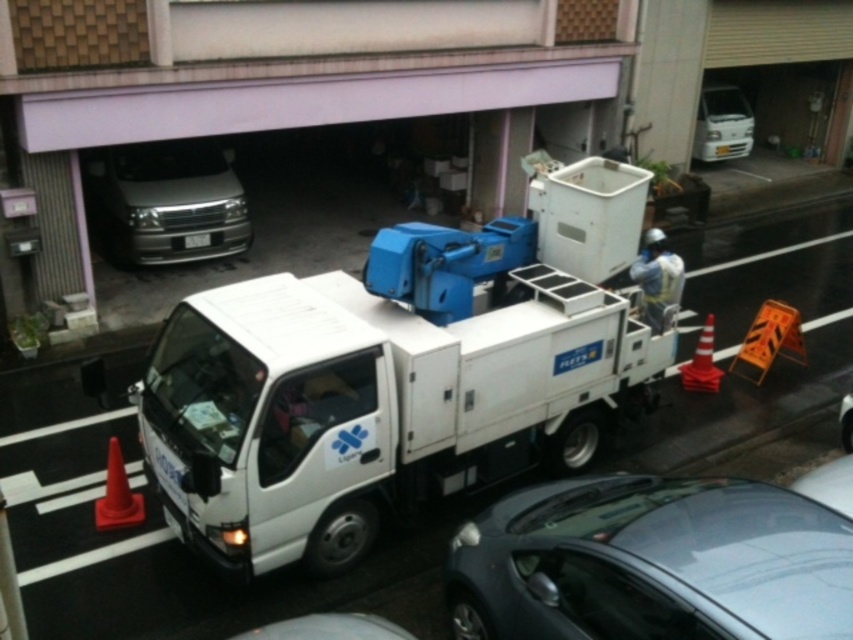
You are a delivery driver who needs to park your car between the satin silver van at center and the white plastic license plate at center. Given that your car is 1.8 meters wide, can you fit your car in the space between them?

The satin silver van at center is wider than the white plastic license plate at center. However, the exact width difference isn not specified, so it is uncertain if the space between them can accommodate a 1.8 meter wide car. More information about the distance between the two objects is needed to determine if there is enough space.

You are a delivery driver who needs to park your car in the parking lot near the white utility truck. The parking spot is located at point 0.880, 0.766. Can you determine if the metallic gray car at center is blocking your parking spot?

The metallic gray car at center is located at point (x=653, y=566), so it is blocking the parking spot at point (x=653, y=563).

You are a delivery driver who needs to park your 12 foot long truck in the area shown in the image. The truck has a turning radius of 40 feet. Based on the scene, can you safely park your truck in the space near point (165, 202) without hitting any obstacles?

The space near point (165, 202) has a satin silver van at center. Since the truck requires a turning radius of 40 feet and the available space is occupied by the van, it would not be safe to park there. Look for an alternative parking spot.